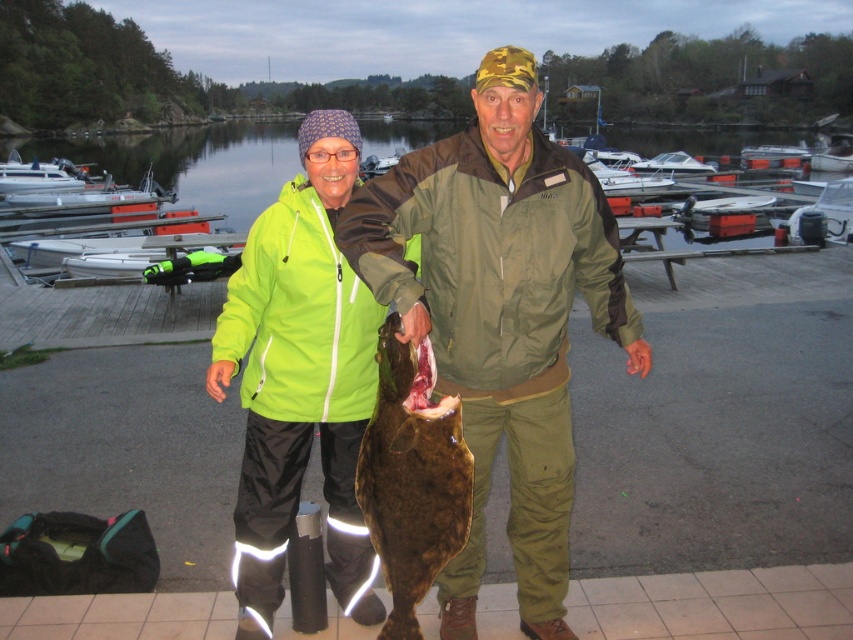
Question: Which point appears closest to the camera in this image?

Choices:
 (A) pyautogui.click(x=257, y=323)
 (B) pyautogui.click(x=439, y=451)
 (C) pyautogui.click(x=503, y=108)
 (D) pyautogui.click(x=679, y=202)

Answer: (B)

Question: Estimate the real-world distances between objects in this image. Which object is farther from the brown rough fish at center?

Choices:
 (A) neon green jacket at center
 (B) white plastic boat at upper center
 (C) green matte jacket at center

Answer: (B)

Question: Which point is farther to the camera?

Choices:
 (A) (515, 552)
 (B) (683, 172)
 (C) (213, 168)

Answer: (C)

Question: Is green matte jacket at center thinner than clear water at center?

Choices:
 (A) yes
 (B) no

Answer: (A)

Question: Is brown rough fish at center behind clear water at center?

Choices:
 (A) yes
 (B) no

Answer: (B)

Question: Can you confirm if green matte jacket at center is smaller than brown rough fish at center?

Choices:
 (A) yes
 (B) no

Answer: (B)